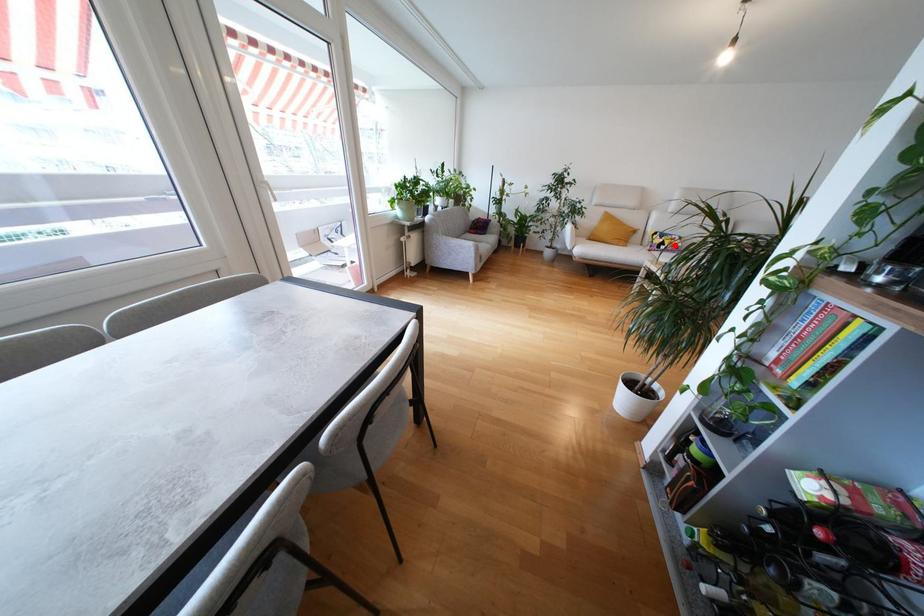
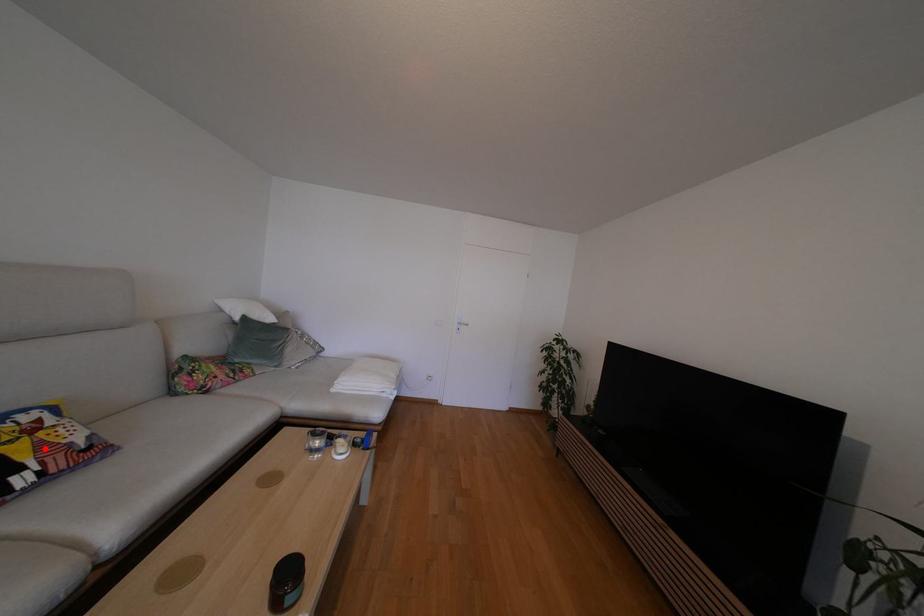
I am providing you with two images of the same scene from different viewpoints. A red point is marked on the first image and another point is marked on the second image. Does the point marked in image1 correspond to the same location as the one in image2?

Yes